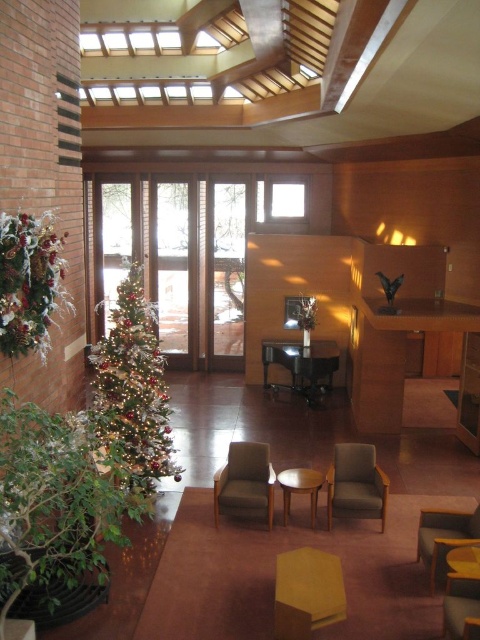
You are standing in the living room and want to move from the point at coordinates point (292, 480) to the point at coordinates point (463, 573). Which direction should you move in relation to the large glass doors at the back?

Since point (292, 480) is behind point (463, 573), you should move towards the large glass doors at the back to reach point (463, 573) from point (292, 480).

You are standing in the modern living room and want to move from the wooden table at center to the wooden armchair at lower right. Which direction should you move in relation to the table?

You should move away from the wooden table at center towards the wooden armchair at lower right since the armchair is further away from the viewer compared to the table.